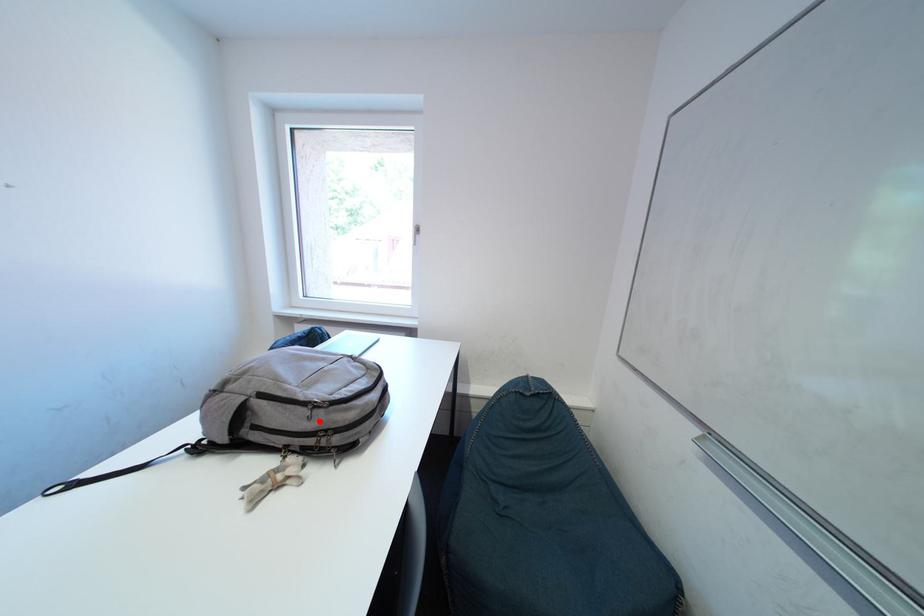
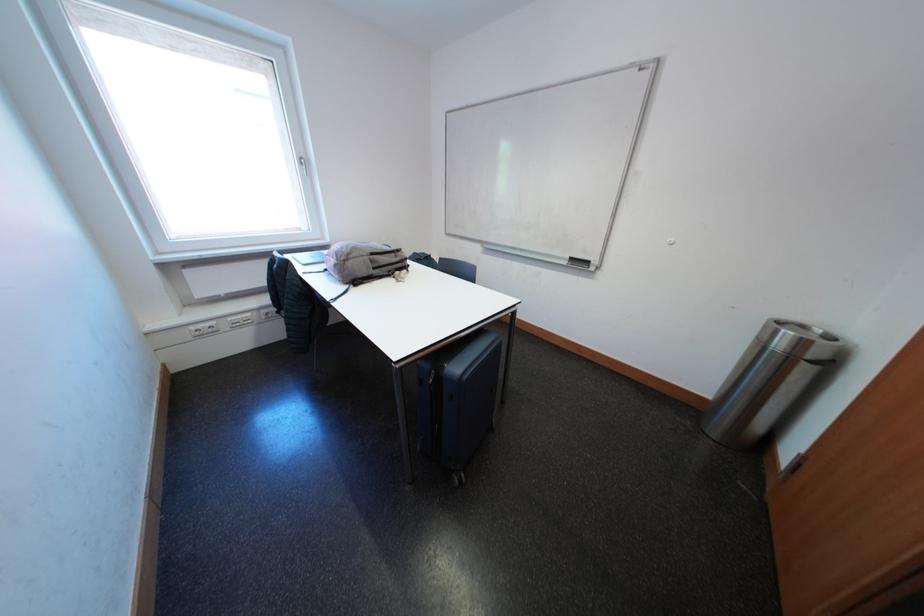
Question: I am providing you with two images of the same scene from different viewpoints. In image1, a red point is highlighted. Considering the same 3D point in image2, which of the following is correct?

Choices:
 (A) It is closer
 (B) It is farther

Answer: (A)